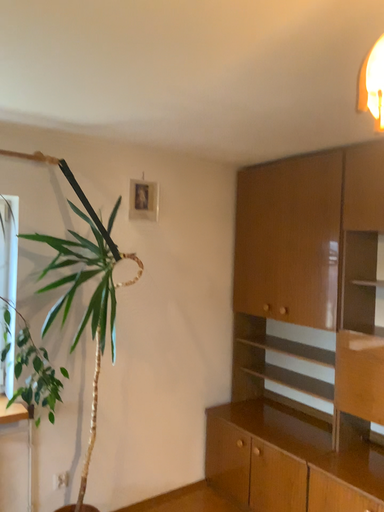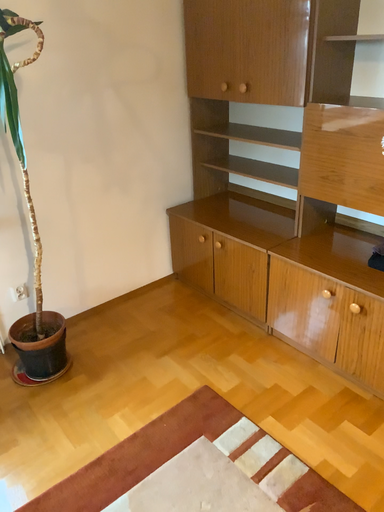
Question: How did the camera likely rotate when shooting the video?

Choices:
 (A) rotated upward
 (B) rotated downward

Answer: (B)